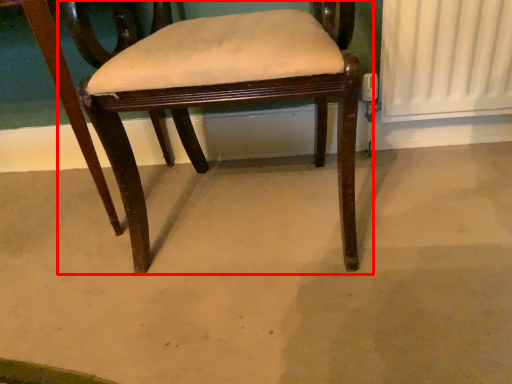
Question: From the image, what is the correct spatial relationship of chair (annotated by the red box) in relation to concrete?

Choices:
 (A) left
 (B) right

Answer: (B)